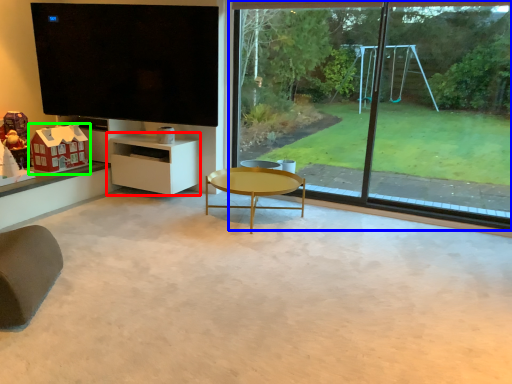
Question: Based on their relative distances, which object is farther from shelf (highlighted by a red box)? Choose from window (highlighted by a blue box) and toy (highlighted by a green box).

Choices:
 (A) window
 (B) toy

Answer: (A)